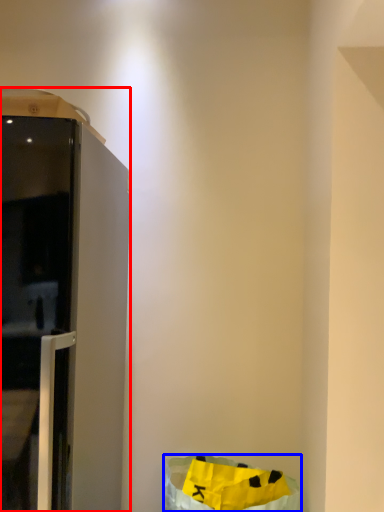
Question: Which object is further to the camera taking this photo, furniture (highlighted by a red box) or recycling bin (highlighted by a blue box)?

Choices:
 (A) furniture
 (B) recycling bin

Answer: (B)